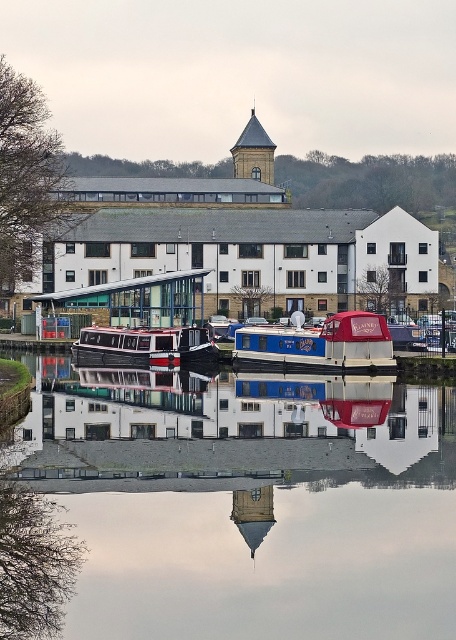
You are standing on the riverside path and want to take a photo of the blue polished wood boat at center and the transparent glass water at center. Which object should you focus on first if you want to capture both in focus without adjusting your camera settings?

You should focus on the blue polished wood boat at center first because it is closer to you than the transparent glass water at center, which is further away. This way, both objects will be in focus since the boat is nearer and the water is behind it.

You are standing on the riverside path and want to take a photo of both the metallic glass dock at center and the smooth glass tower at center. Which object should you position yourself closer to in order to include both in your frame without zooming?

You should position yourself closer to the metallic glass dock at center since it is located to the left of the smooth glass tower at center, allowing both to be captured in the frame when positioned appropriately.

You are standing at the point closest to the building. Which point, point (117, 406) or point (88, 301), is closer to you?

Point (88, 301) is closer to you because it is behind point (117, 406), which is in front of it.